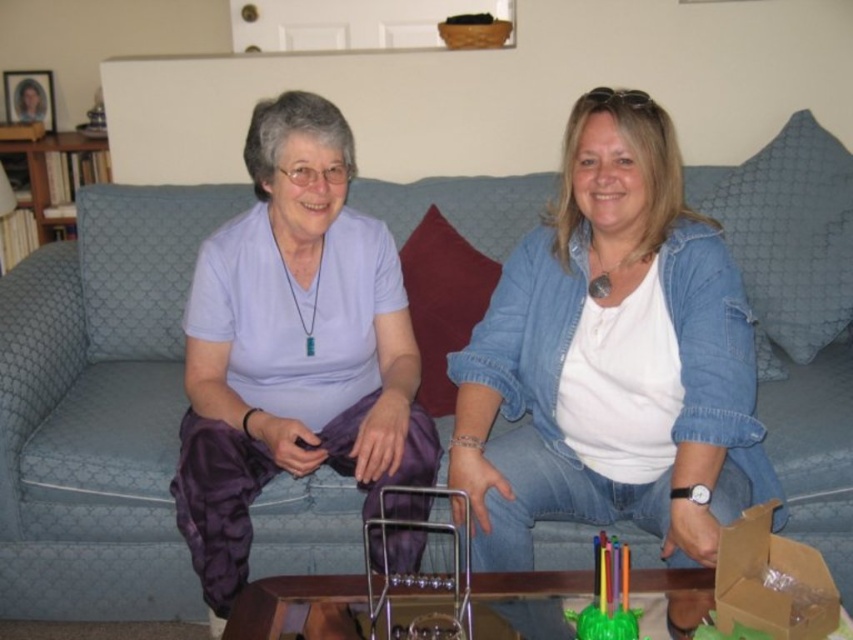
Question: Does white matte shirt at center have a greater width compared to purple satin pants at center?

Choices:
 (A) no
 (B) yes

Answer: (B)

Question: Which is nearer to the white matte shirt at center?

Choices:
 (A) purple satin pants at center
 (B) translucent plastic toy at center

Answer: (B)

Question: Among these points, which one is farthest from the camera?

Choices:
 (A) (213, 632)
 (B) (608, 588)
 (C) (674, 500)

Answer: (A)

Question: Can you confirm if white matte shirt at center is positioned to the left of purple satin pants at center?

Choices:
 (A) yes
 (B) no

Answer: (B)

Question: Which of the following is the closest to the observer?

Choices:
 (A) purple satin pants at center
 (B) translucent plastic toy at center

Answer: (B)

Question: Is purple satin pants at center behind translucent plastic toy at center?

Choices:
 (A) yes
 (B) no

Answer: (A)